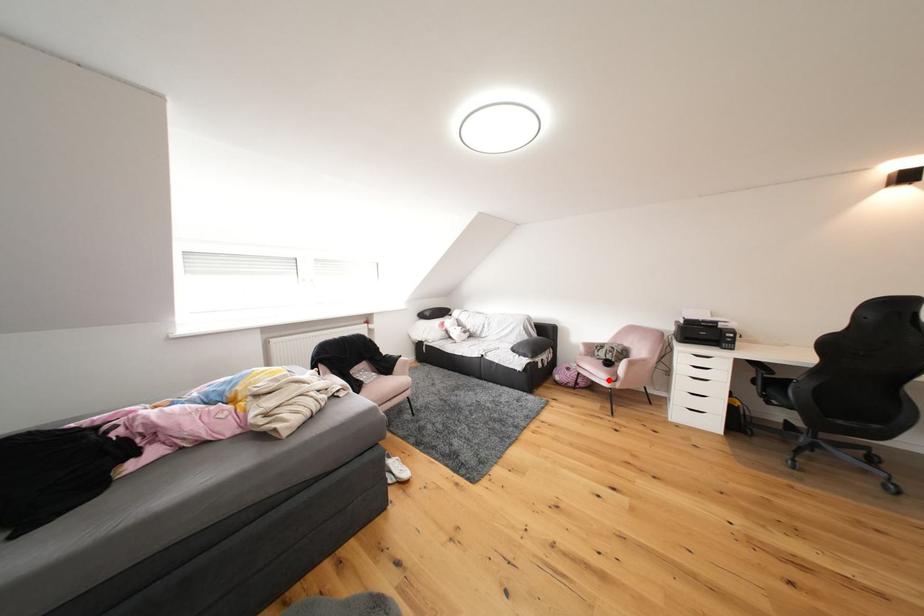
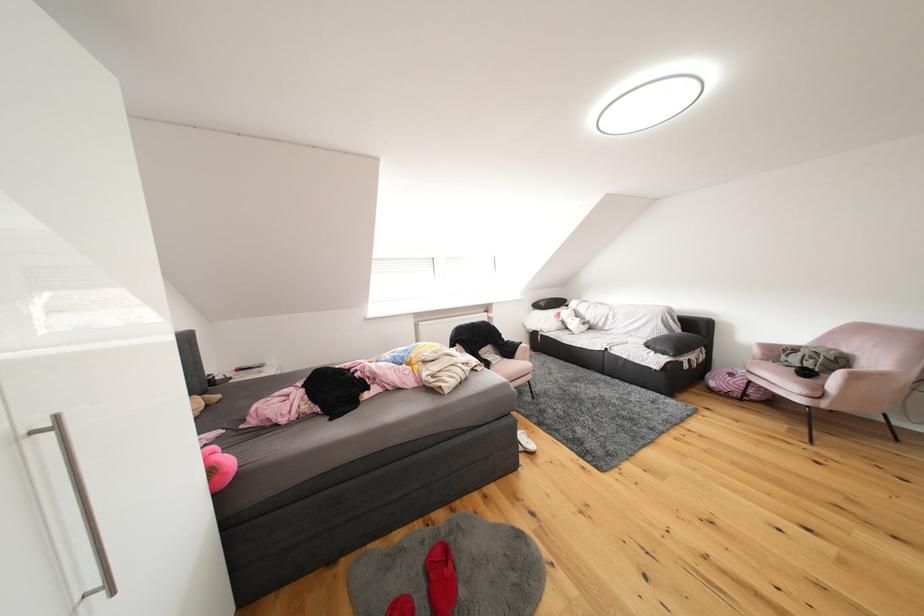
Where in the second image is the point corresponding to the highlighted location from the first image?

(797, 392)